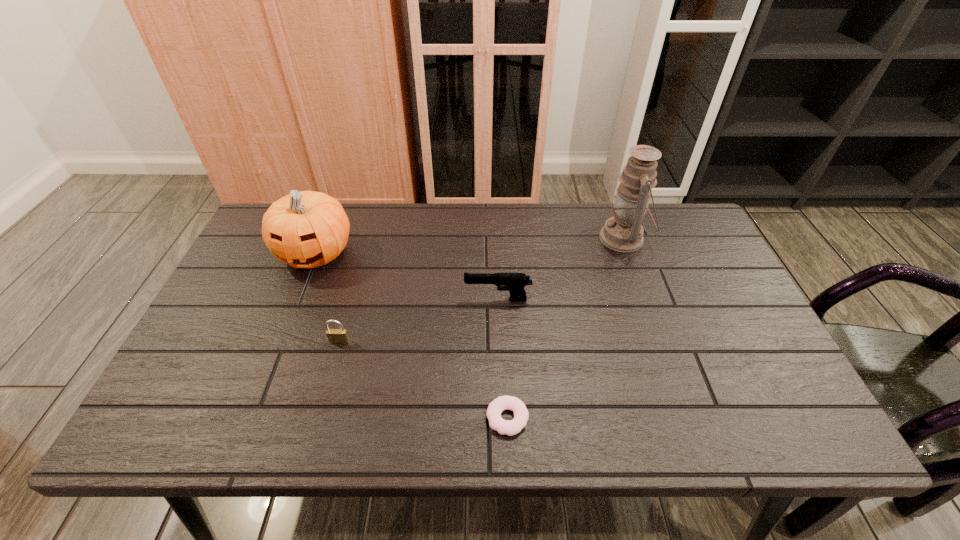
Where is `free location that satisfies the following two spatial constraints: 1. on the front-facing side of the shortest object; 2. on the left side of the pumpkin`? The height and width of the screenshot is (540, 960). free location that satisfies the following two spatial constraints: 1. on the front-facing side of the shortest object; 2. on the left side of the pumpkin is located at coordinates (251, 418).

Identify the location of free spot that satisfies the following two spatial constraints: 1. on the front-facing side of the third shortest object; 2. on the front-facing side of the second object from left to right. The width and height of the screenshot is (960, 540). click(499, 341).

Image resolution: width=960 pixels, height=540 pixels. Identify the location of vacant space that satisfies the following two spatial constraints: 1. on the front-facing side of the third nearest object; 2. on the back side of the doughnut. (502, 418).